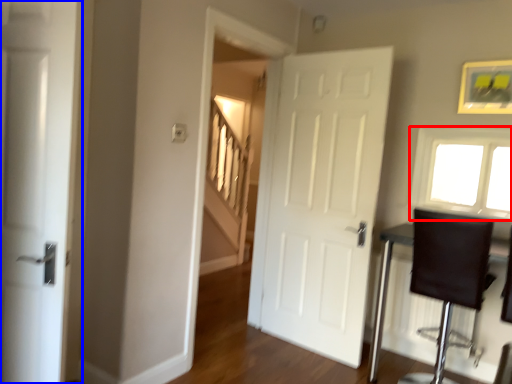
Question: Which point is closer to the camera, window (highlighted by a red box) or door (highlighted by a blue box)?

Choices:
 (A) window
 (B) door

Answer: (B)